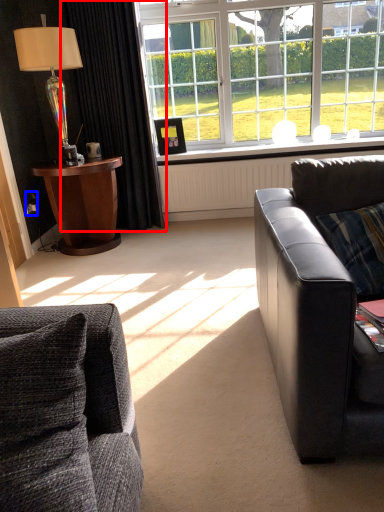
Question: Which of the following is the closest to the observer, curtain (highlighted by a red box) or power outlet (highlighted by a blue box)?

Choices:
 (A) curtain
 (B) power outlet

Answer: (A)